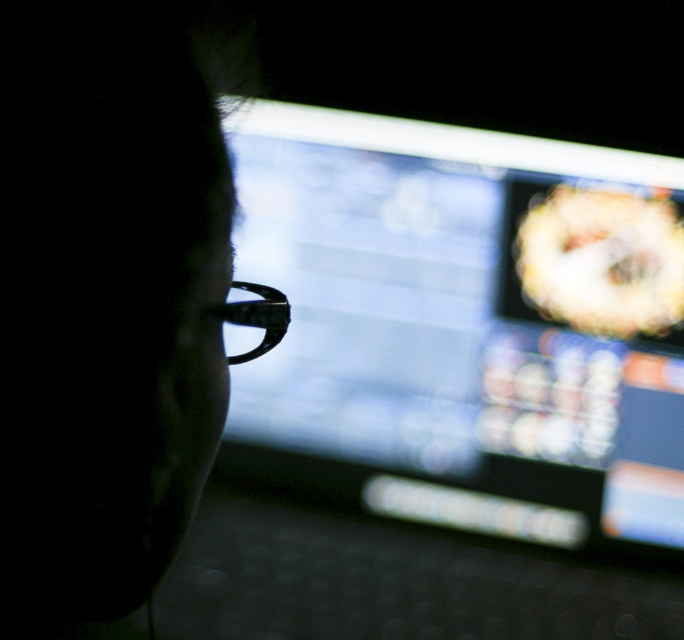
Which is above, matte black monitor at center or black matte glasses at left?

Positioned higher is matte black monitor at center.

Who is more distant from viewer, (360, 296) or (5, 3)?

The point (360, 296) is behind.

The width and height of the screenshot is (684, 640). What are the coordinates of `matte black monitor at center` in the screenshot? It's located at (464, 324).

Which is in front, point (436, 241) or point (231, 316)?

Positioned in front is point (231, 316).

Can you confirm if matte black monitor at center is taller than black plastic glasses at center?

Yes.

Between point (479, 298) and point (278, 296), which one is positioned in front?

Point (278, 296)

You are a GUI agent. You are given a task and a screenshot of the screen. Output one action in this format:
    pyautogui.click(x=<x>, y=<y>)
    Task: Click on the matte black monitor at center
    The image size is (684, 640).
    Given the screenshot: What is the action you would take?
    pyautogui.click(x=464, y=324)

Who is taller, black matte glasses at left or black plastic glasses at center?

black matte glasses at left

Describe the element at coordinates (105, 301) in the screenshot. I see `black matte glasses at left` at that location.

At what (x,y) coordinates should I click in order to perform the action: click on black matte glasses at left. Please return your answer as a coordinate pair (x, y). This screenshot has height=640, width=684. Looking at the image, I should click on (105, 301).